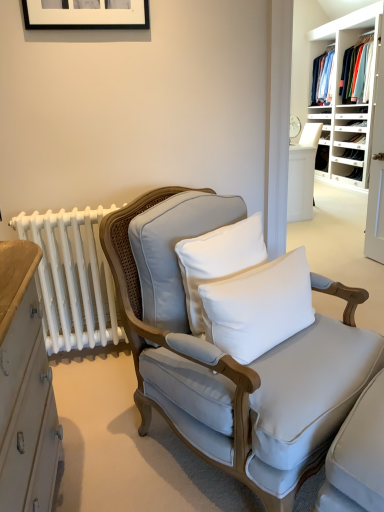
Question: Visually, is white cotton pillow at center, which is counted as the second pillow, starting from the left, positioned to the left or to the right of black matte picture frame at upper center?

Choices:
 (A) right
 (B) left

Answer: (A)

Question: In the image, is white cotton pillow at center, positioned as the first pillow in right-to-left order, positioned in front of or behind black matte picture frame at upper center?

Choices:
 (A) behind
 (B) front

Answer: (B)

Question: Estimate the real-world distances between objects in this image. Which object is farther from the white cotton pillow at center, which is counted as the second pillow, starting from the left?

Choices:
 (A) white cotton pillow at center, which appears as the first pillow when viewed from the left
 (B) black matte picture frame at upper center
 (C) light gray fabric chair at center
 (D) blue cotton shirt at upper right
 (E) white wood shelves at upper right

Answer: (D)

Question: Estimate the real-world distances between objects in this image. Which object is farther from the white cotton pillow at center, positioned as the first pillow in right-to-left order?

Choices:
 (A) white wood shelves at upper right
 (B) light gray fabric chair at center
 (C) black matte picture frame at upper center
 (D) white cotton pillow at center, positioned as the 2th pillow in right-to-left order
 (E) blue cotton shirt at upper right

Answer: (E)